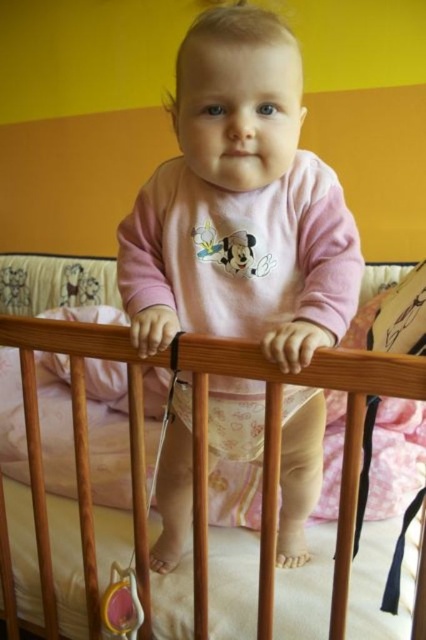
Between pink matte/satin baby at center and wooden crib at center, which one appears on the right side from the viewer's perspective?

Positioned to the right is pink matte/satin baby at center.

What do you see at coordinates (239, 205) in the screenshot? I see `pink matte/satin baby at center` at bounding box center [239, 205].

This screenshot has width=426, height=640. What do you see at coordinates (239, 205) in the screenshot?
I see `pink matte/satin baby at center` at bounding box center [239, 205].

This screenshot has height=640, width=426. Find the location of `pink matte/satin baby at center`. pink matte/satin baby at center is located at coordinates (239, 205).